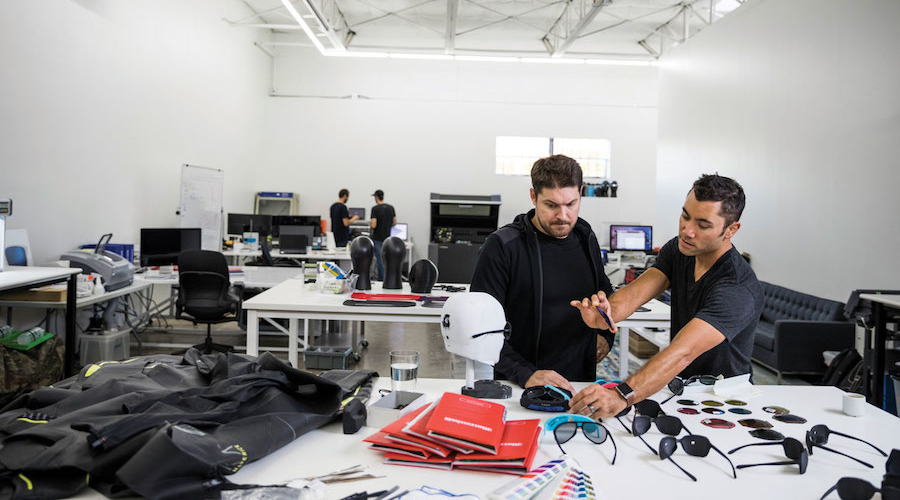
Identify the location of walls. This screenshot has width=900, height=500. (162, 109).